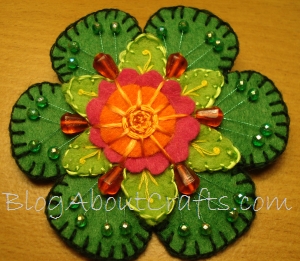
Locate an element on the screen. The width and height of the screenshot is (300, 261). pink felt is located at coordinates (178, 139), (99, 102).